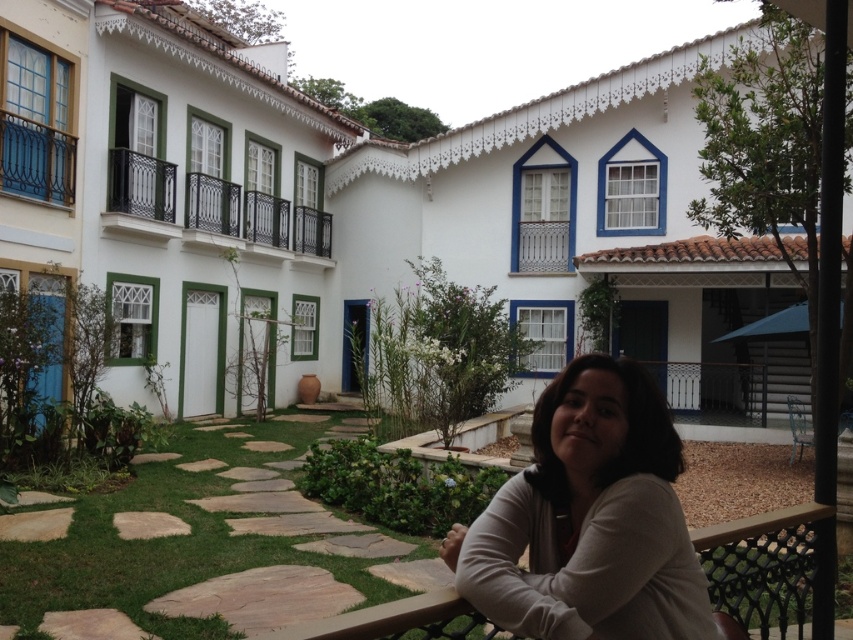
You are a photographer trying to capture the courtyard scene. You notice the white matte shirt at lower right and the black wrought iron balcony at upper left. Which object should you focus on if you want to photograph the larger one?

The white matte shirt at lower right is bigger than the black wrought iron balcony at upper left, so you should focus on the white matte shirt at lower right.

You are standing in the courtyard and want to take a photo of the white matte shirt at lower right. Where should you position yourself to capture the subject in the frame?

To capture the white matte shirt at lower right in the frame, position yourself at the coordinates corresponding to the shirt at point [589,518].

You are standing in the courtyard and want to take a photo. There are two points in the scene labeled as point 1 and point 2. Point 1 is at coordinates point (602, 579) and point 2 is at point (1, 177). Which point will appear larger in your photo?

Point 1 at coordinates point (602, 579) will appear larger in the photo because it is closer to the camera than point 2 at point (1, 177).